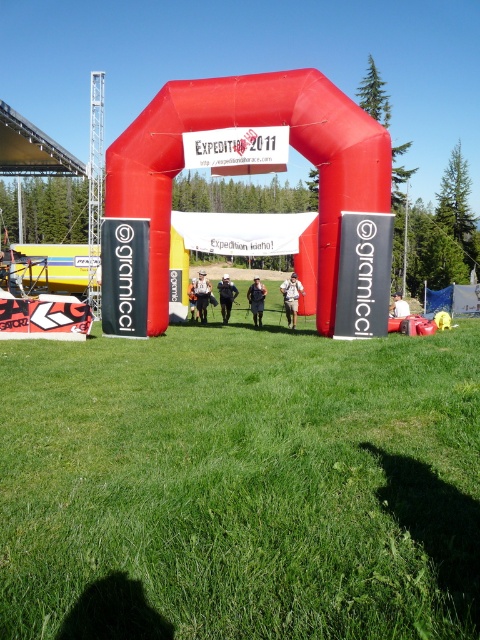
You are standing at the point marked by the coordinates point (226, 296). Looking around, you see the large red archway with the Expedition 2011 banner and the Expedition Idaho! banner. What object is located exactly at your current position?

The point (226, 296) corresponds to the dark gray jacket at center, so the dark gray jacket at center is located exactly at your current position.

You are a photographer at the event and need to capture a photo of both the dark blue jeans at center and the dark gray jacket at center. Which object should you zoom in on to ensure both are clearly visible in the frame?

Since the dark blue jeans at center is smaller than the dark gray jacket at center, you should zoom in on the dark gray jacket at center to ensure both objects are clearly visible in the frame.